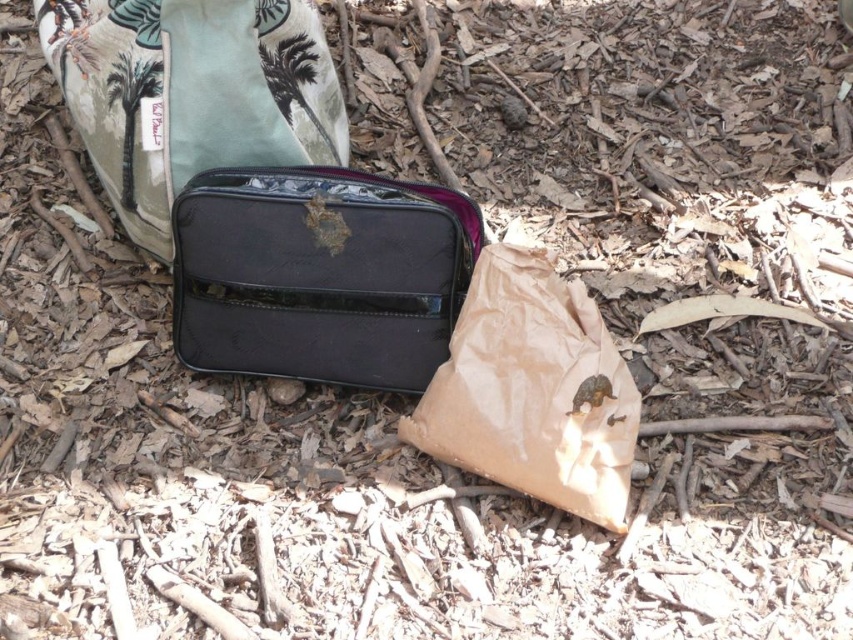
Measure the distance from glossy black bag at center to brown paper bag at center.

A distance of 10.15 inches exists between glossy black bag at center and brown paper bag at center.

Which is behind, point (241, 221) or point (497, 436)?

Positioned behind is point (241, 221).

At what (x,y) coordinates should I click in order to perform the action: click on glossy black bag at center. Please return your answer as a coordinate pair (x, y). Looking at the image, I should click on (318, 275).

Is glossy black bag at center above glossy black pouch at center?

Actually, glossy black bag at center is below glossy black pouch at center.

Who is shorter, glossy black bag at center or glossy black pouch at center?

With less height is glossy black bag at center.

This screenshot has width=853, height=640. Describe the element at coordinates (318, 275) in the screenshot. I see `glossy black bag at center` at that location.

Where is `glossy black bag at center`? glossy black bag at center is located at coordinates (318, 275).

Does glossy black pouch at center come behind brown paper bag at center?

Yes, it is behind brown paper bag at center.

Is glossy black pouch at center bigger than brown paper bag at center?

Indeed, glossy black pouch at center has a larger size compared to brown paper bag at center.

Find the location of `glossy black pouch at center`. glossy black pouch at center is located at coordinates (190, 93).